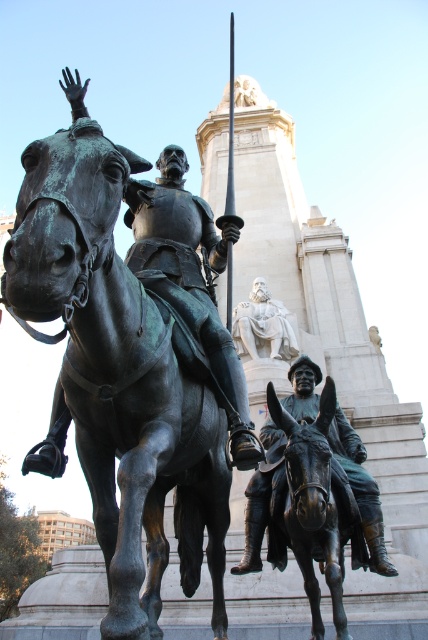
In the scene shown: You are an art student trying to sketch the scene. You want to ensure the proportions are accurate. Which horse, the green patina horse at center or the bronze horse at lower center, should you draw wider to match the actual sculpture?

The green patina horse at center should be drawn wider than the bronze horse at lower center because the description states it might be wider.

You are standing in front of the equestrian statue and want to take a photo. There are two points of interest marked in the scene at coordinates point (35, 269) and point (335, 628). Which point is closer to your current position?

Point (35, 269) is closer to the camera than point (335, 628), so it is closer to your current position.